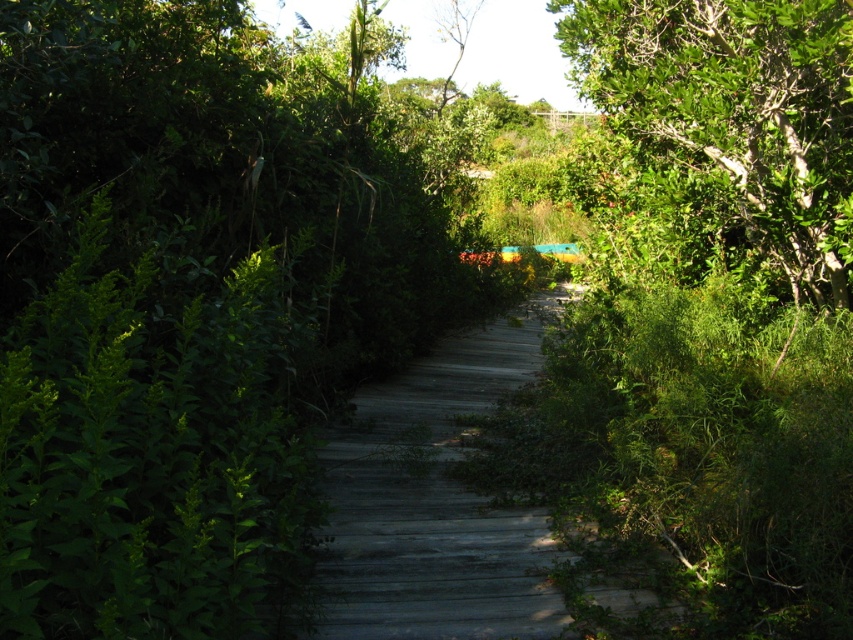
Question: Is weathered wood trail at center in front of green leafy tree at upper center?

Choices:
 (A) no
 (B) yes

Answer: (B)

Question: Which of the following is the farthest from the observer?

Choices:
 (A) weathered wood trail at center
 (B) green leafy tree at upper right
 (C) green leafy tree at upper center

Answer: (C)

Question: In this image, where is weathered wood trail at center located relative to green leafy tree at upper center?

Choices:
 (A) below
 (B) above

Answer: (A)

Question: Can you confirm if green leafy tree at upper right is positioned below green leafy tree at upper center?

Choices:
 (A) yes
 (B) no

Answer: (A)

Question: Which of these objects is positioned farthest from the green leafy tree at upper right?

Choices:
 (A) green leafy tree at upper center
 (B) weathered wood trail at center

Answer: (A)

Question: Which of the following is the closest to the observer?

Choices:
 (A) weathered wood trail at center
 (B) green leafy tree at upper right
 (C) green leafy tree at upper center

Answer: (B)